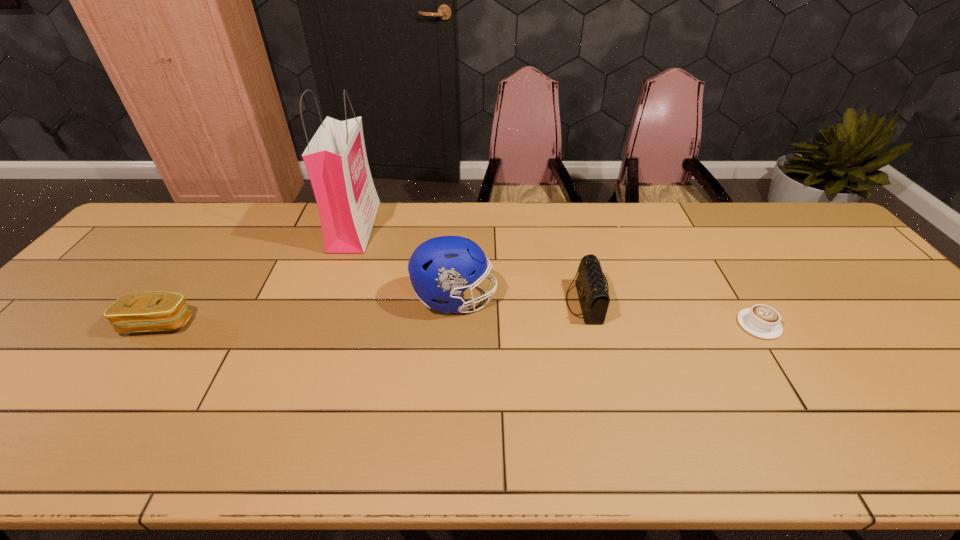
Image resolution: width=960 pixels, height=540 pixels. Find the location of `vacant area at the left edge of the desktop`. vacant area at the left edge of the desktop is located at coordinates (113, 291).

In the image, there is a desktop. At what (x,y) coordinates should I click in order to perform the action: click on vacant area at the far right corner. Please return your answer as a coordinate pair (x, y). The width and height of the screenshot is (960, 540). Looking at the image, I should click on (798, 227).

At what (x,y) coordinates should I click in order to perform the action: click on free space that is in between the leftmost object and the right clutch bag. Please return your answer as a coordinate pair (x, y). This screenshot has height=540, width=960. Looking at the image, I should click on (372, 313).

Where is `vacant region between the shorter clutch bag and the fourth object from right to left`? The width and height of the screenshot is (960, 540). vacant region between the shorter clutch bag and the fourth object from right to left is located at coordinates click(256, 275).

Locate an element on the screen. This screenshot has width=960, height=540. free spot between the fourth shortest object and the left clutch bag is located at coordinates (306, 312).

Locate an element on the screen. unoccupied area between the fourth object from right to left and the cappuccino is located at coordinates (557, 275).

You are a GUI agent. You are given a task and a screenshot of the screen. Output one action in this format:
    pyautogui.click(x=<x>, y=<y>)
    Task: Click on the free point between the fourth tallest object and the right clutch bag
    
    Given the screenshot: What is the action you would take?
    pyautogui.click(x=372, y=313)

The width and height of the screenshot is (960, 540). Find the location of `blank region between the right clutch bag and the second tallest object`. blank region between the right clutch bag and the second tallest object is located at coordinates (519, 301).

Identify the location of vacant space in between the left clutch bag and the shortest object. This screenshot has width=960, height=540. (459, 325).

Find the location of a particular element. free space between the rightmost object and the left clutch bag is located at coordinates pos(459,325).